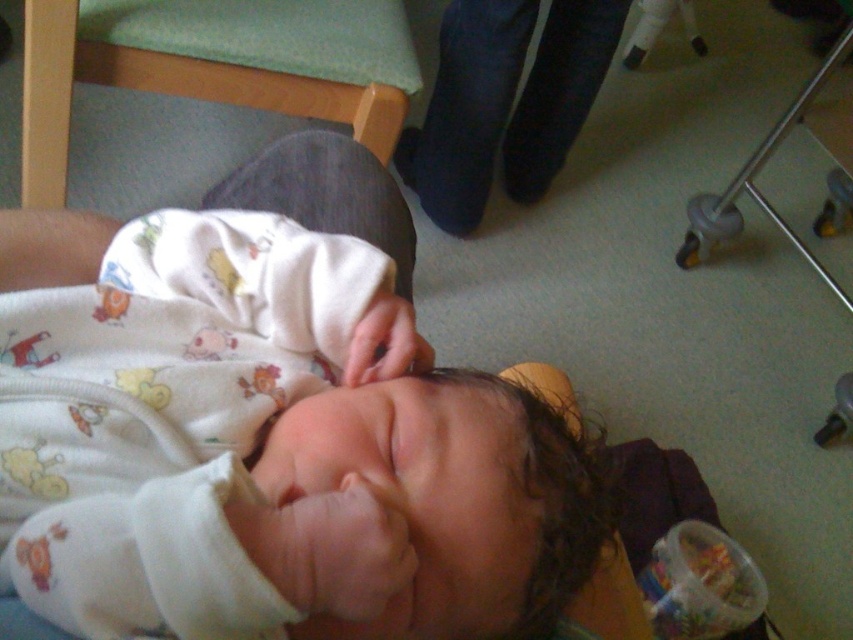
You are a photographer setting up for a baby photoshoot. You need to place a white soft fabric newborn at center and dark blue jeans at upper center in the scene. According to the image, which object is on the left side when looking at both objects?

The white soft fabric newborn at center is positioned on the left side of dark blue jeans at upper center.

You are a parent preparing to dress your baby. You have two options on the bed in front of you, the white soft fabric newborn at center and the dark blue jeans at upper center. Which clothing item is more suitable for a newborn baby?

The white soft fabric newborn at center is more suitable for a newborn baby because it is thinner than the dark blue jeans at upper center, making it more comfortable and appropriate for a baby.

You are standing 6 feet away from the image. Is the point at coordinate point (521, 6) closer to you than the edge of the image?

The distance of point (521, 6) from viewer is 5.05 feet, so yes, the point at coordinate point (521, 6) is closer to you than the edge of the image since it is within the 6 feet distance.